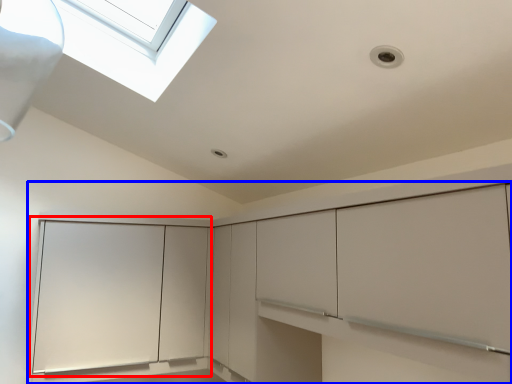
Question: Among these objects, which one is nearest to the camera, glass door (highlighted by a red box) or cabinetry (highlighted by a blue box)?

Choices:
 (A) glass door
 (B) cabinetry

Answer: (B)